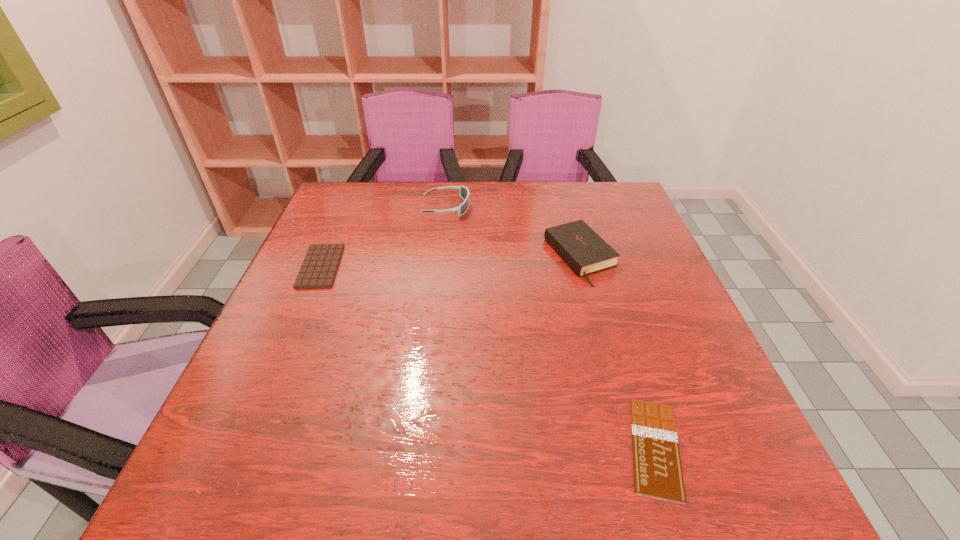
Locate an element on the screen. the farthest object is located at coordinates (464, 193).

In order to click on the tallest object in this screenshot , I will do `click(464, 193)`.

Identify the location of Bible. (580, 247).

Where is `the farther chocolate bar`? The image size is (960, 540). the farther chocolate bar is located at coordinates (320, 265).

What are the coordinates of `the leftmost object` in the screenshot? It's located at (320, 265).

Identify the location of the shorter chocolate bar. (657, 466).

Locate an element on the screen. This screenshot has width=960, height=540. the nearest object is located at coordinates (657, 466).

Find the location of `vacant region located on the front-facing side of the tallest object`. vacant region located on the front-facing side of the tallest object is located at coordinates (524, 207).

This screenshot has height=540, width=960. I want to click on vacant space situated 0.220m on the left of the Bible, so click(x=462, y=256).

This screenshot has height=540, width=960. What are the coordinates of `vacant space located on the right of the leftmost object` in the screenshot? It's located at (396, 266).